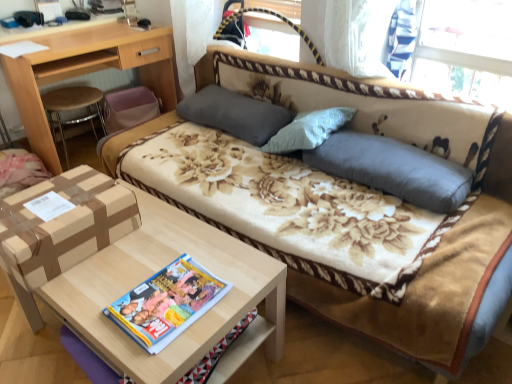
This screenshot has width=512, height=384. Identify the location of free space above multicolored glossy magazine at center (from a real-world perspective). click(166, 299).